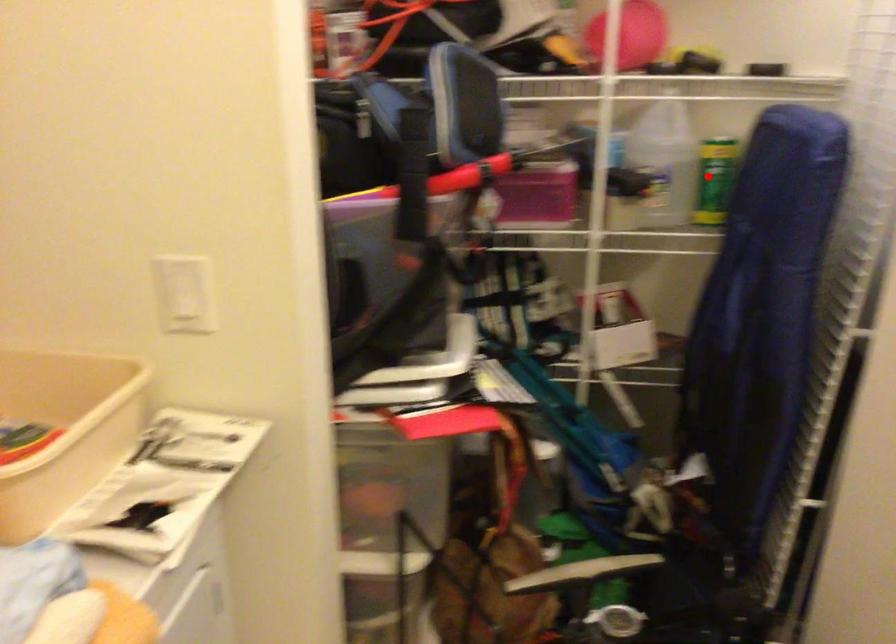
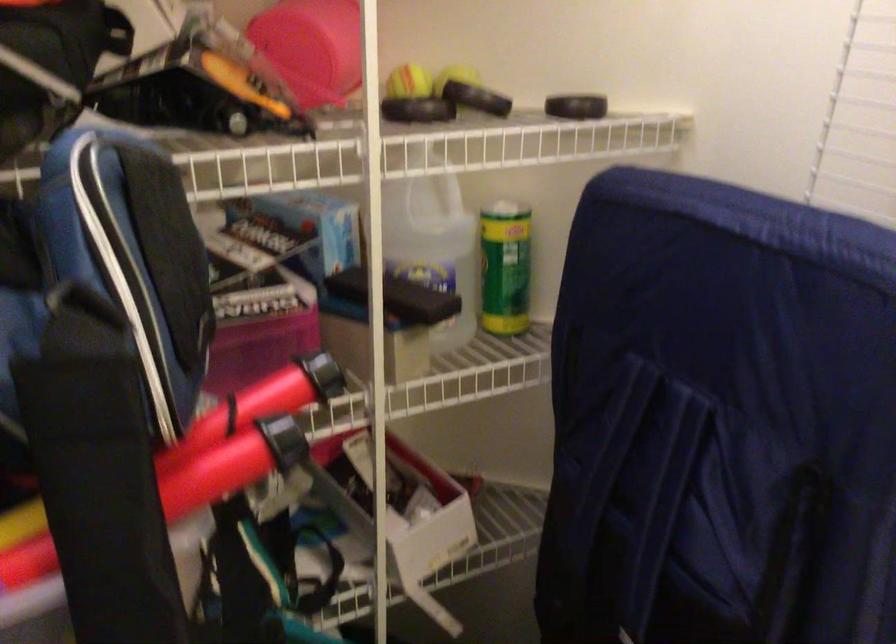
Question: I am providing you with two images of the same scene from different viewpoints. A red point is shown in image1. For the corresponding object point in image2, is it positioned nearer or farther from the camera?

Choices:
 (A) Nearer
 (B) Farther

Answer: (A)